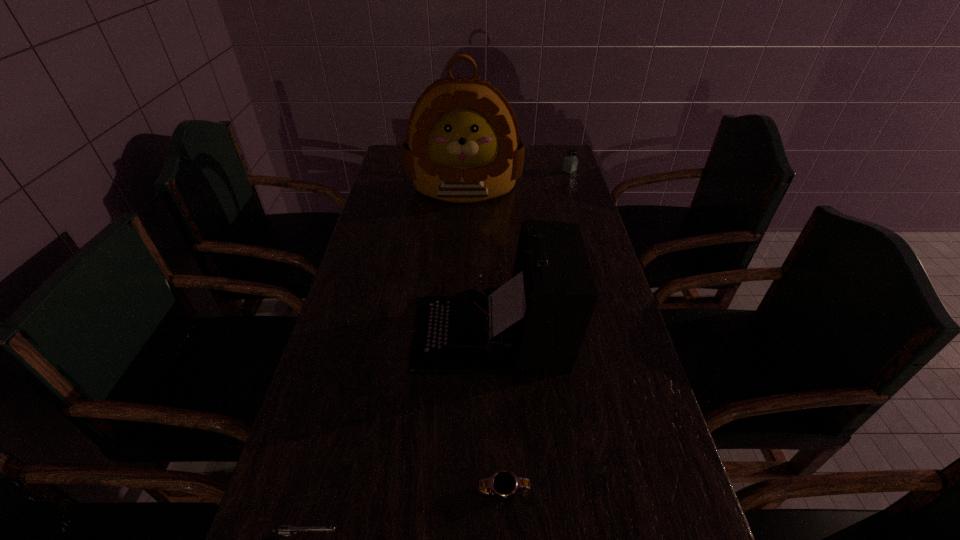
Identify the location of free space located 0.130m on the left of the rightmost object. The image size is (960, 540). (528, 171).

Image resolution: width=960 pixels, height=540 pixels. Find the location of `vacant region located 0.400m on the back of the shortest object`. vacant region located 0.400m on the back of the shortest object is located at coordinates (497, 319).

I want to click on backpack present at the far edge, so click(462, 145).

Locate an element on the screen. This screenshot has height=540, width=960. saltshaker at the far edge is located at coordinates (570, 162).

Identify the location of object at the left edge. (462, 145).

Where is `typewriter located at the right edge`? This screenshot has width=960, height=540. typewriter located at the right edge is located at coordinates (537, 321).

This screenshot has width=960, height=540. I want to click on saltshaker that is positioned at the right edge, so click(x=570, y=162).

Where is `object situated at the far left corner`? This screenshot has width=960, height=540. object situated at the far left corner is located at coordinates (462, 145).

This screenshot has height=540, width=960. Find the location of `object that is at the far right corner`. object that is at the far right corner is located at coordinates (570, 162).

In the image, there is a desktop. In order to click on vacant space at the left edge in this screenshot , I will do `click(379, 220)`.